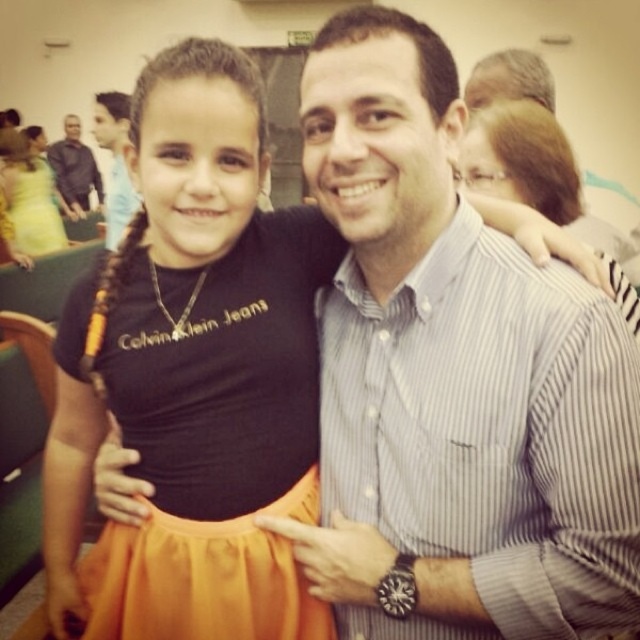
Is point (122, 140) farther from viewer compared to point (65, 145)?

No.

Between matte black shirt at upper center and black shirt at upper left, which one is positioned higher?

black shirt at upper left is higher up.

The width and height of the screenshot is (640, 640). What are the coordinates of `matte black shirt at upper center` in the screenshot? It's located at (115, 163).

Image resolution: width=640 pixels, height=640 pixels. Find the location of `orange satin dress at center`. orange satin dress at center is located at coordinates (216, 436).

Between orange satin dress at center and orange fabric pigtail at upper left, which one has less height?

With less height is orange fabric pigtail at upper left.

Which is in front, point (301, 368) or point (113, 301)?

Point (113, 301)

Where is `orange satin dress at center`? The image size is (640, 640). orange satin dress at center is located at coordinates point(216,436).

Is striped shirt at upper right positioned behind matte black shirt at upper center?

No, striped shirt at upper right is in front of matte black shirt at upper center.

Which is in front, point (524, 83) or point (92, 131)?

Positioned in front is point (524, 83).

Identify the location of striped shirt at upper right. (509, 80).